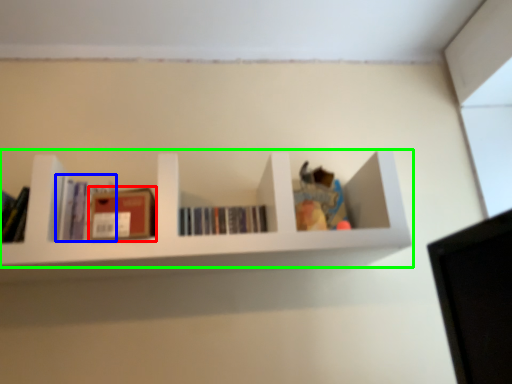
Question: Which object is the farthest from paperback book (highlighted by a red box)? Choose among these: book (highlighted by a blue box) or shelf (highlighted by a green box).

Choices:
 (A) book
 (B) shelf

Answer: (B)